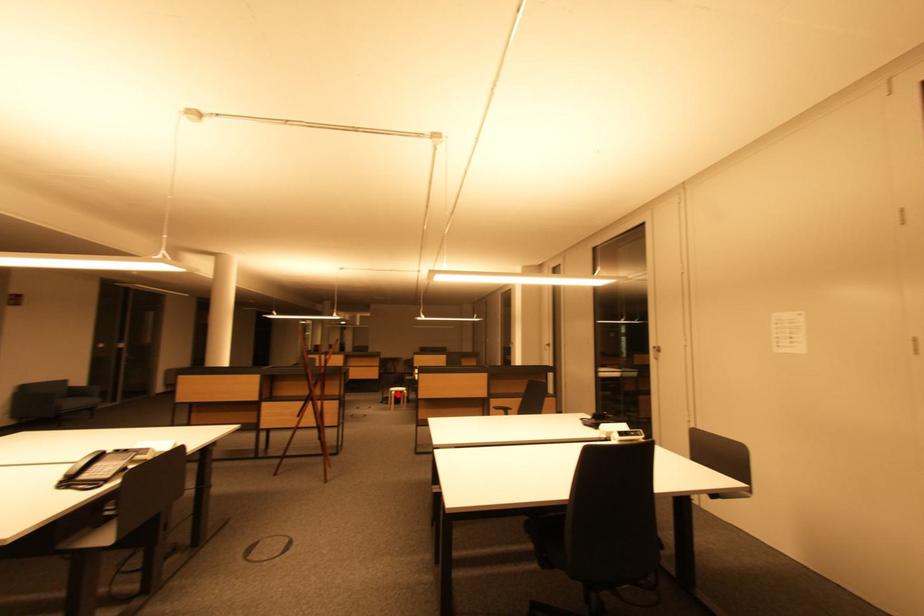
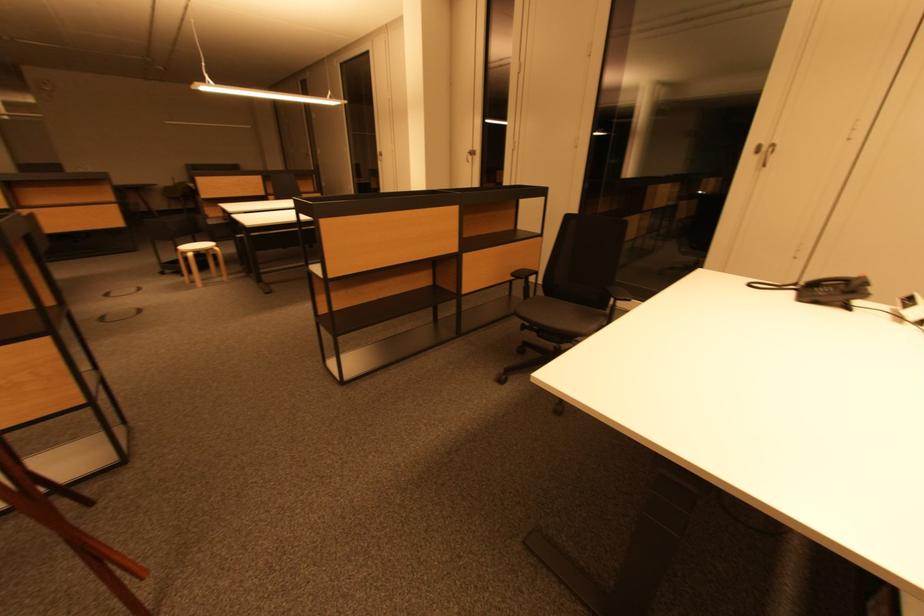
Where in the second image is the point corresponding to the highlighted location from the first image?

(193, 256)